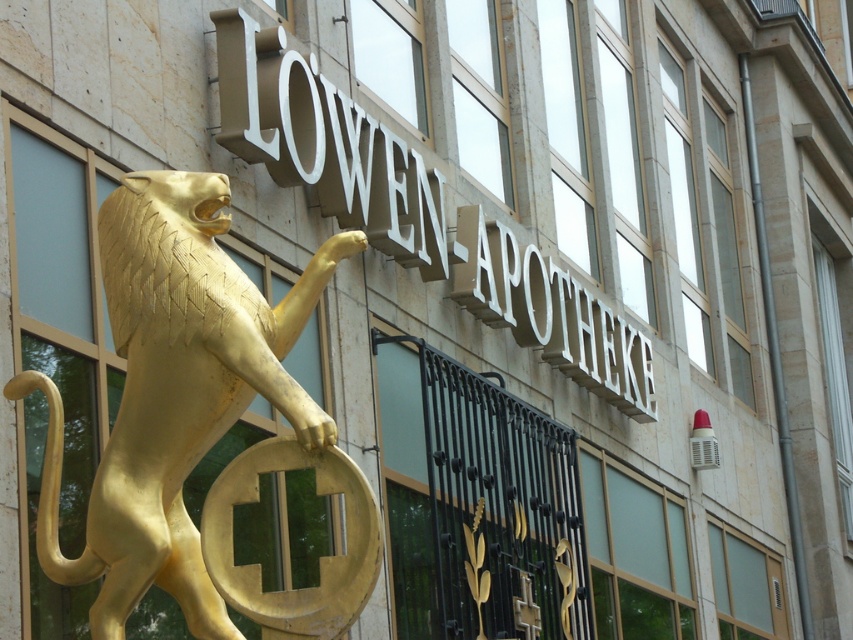
Is the position of gold polished lion at left less distant than that of matte gold sign at upper center?

Yes, it is.

Who is positioned more to the right, gold polished lion at left or matte gold sign at upper center?

From the viewer's perspective, matte gold sign at upper center appears more on the right side.

Find the location of a particular element. The image size is (853, 640). gold polished lion at left is located at coordinates (173, 392).

The image size is (853, 640). What are the coordinates of `gold polished lion at left` in the screenshot? It's located at (173, 392).